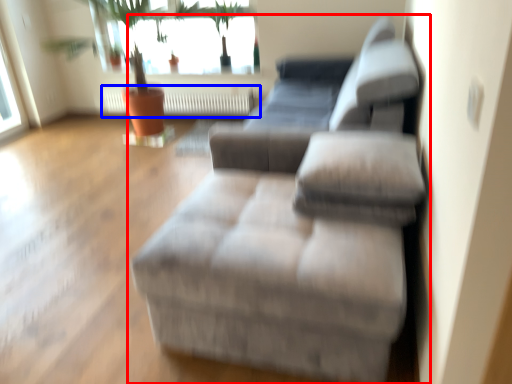
Question: Which object appears farthest to the camera in this image, studio couch (highlighted by a red box) or radiator (highlighted by a blue box)?

Choices:
 (A) studio couch
 (B) radiator

Answer: (B)